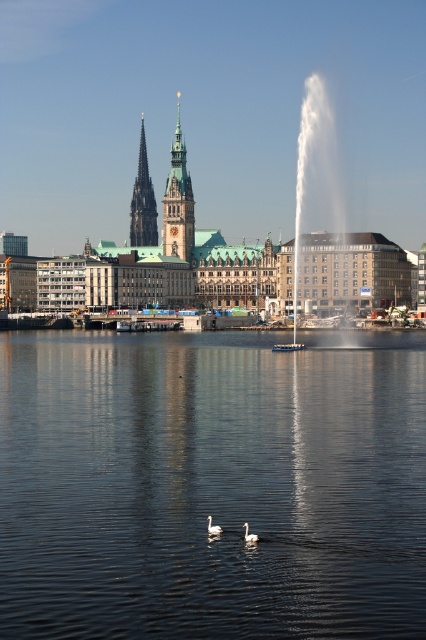
You are a photographer trying to capture the white matte swan at center without the transparent water at center obstructing the view. Is this possible given their positions?

The transparent water at center is positioned over the white matte swan at center, so it would obstruct the view of the swan. You cannot capture the white matte swan at center without the transparent water at center in the way.

Consider the image. You are a city planner assessing the urban waterfront scene. You need to install a new walkway between the transparent water at center and the green stone tower at center. The walkway must be exactly 60 meters long. Based on the scene description, will the walkway fit between them?

The transparent water at center and green stone tower at center are 61.00 meters apart from each other. Since the walkway is 60 meters long, it will be 1 meter shorter than the required distance between them. Therefore, the walkway will not fit between them as it is too short.

In the urban waterfront scene with the historic building and the fountain, where is the transparent water at center located?

The transparent water at center is located at point (x=212, y=486).